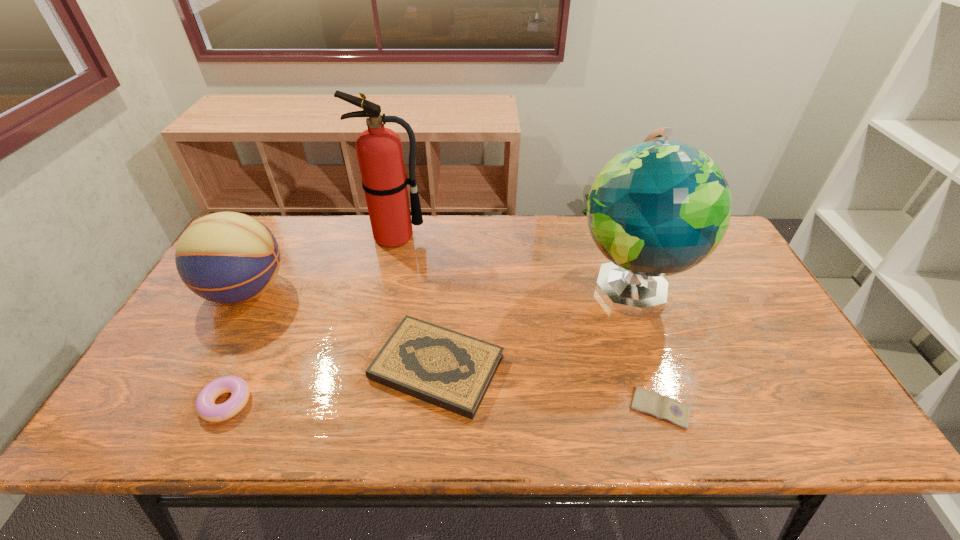
Where is `vacant space at the far left corner of the desktop`? This screenshot has width=960, height=540. vacant space at the far left corner of the desktop is located at coordinates (289, 224).

You are a GUI agent. You are given a task and a screenshot of the screen. Output one action in this format:
    pyautogui.click(x=<x>, y=<y>)
    Task: Click on the blank space at the near left corner of the desktop
    This screenshot has width=960, height=540.
    Given the screenshot: What is the action you would take?
    pyautogui.click(x=132, y=416)

Identify the location of vacant space that is in between the third tallest object and the doughnut. This screenshot has height=540, width=960. (236, 347).

Find the location of a particular element. The width and height of the screenshot is (960, 540). empty location between the globe and the hardback book is located at coordinates (533, 327).

Find the location of `free point between the fire extinguisher and the globe`. free point between the fire extinguisher and the globe is located at coordinates (513, 261).

In order to click on free space between the basketball and the doughnut in this screenshot , I will do `click(236, 347)`.

Locate an element on the screen. This screenshot has width=960, height=540. empty location between the hardback book and the basketball is located at coordinates (342, 329).

You are a GUI agent. You are given a task and a screenshot of the screen. Output one action in this format:
    pyautogui.click(x=<x>, y=<y>)
    Task: Click on the empty space that is in between the globe and the diary
    This screenshot has height=540, width=960.
    Given the screenshot: What is the action you would take?
    pyautogui.click(x=644, y=347)

The image size is (960, 540). In order to click on vacant space that is in between the hardback book and the fire extinguisher in this screenshot , I will do `click(417, 302)`.

Find the location of a particular element. object that is the second closest one to the shortest object is located at coordinates (451, 370).